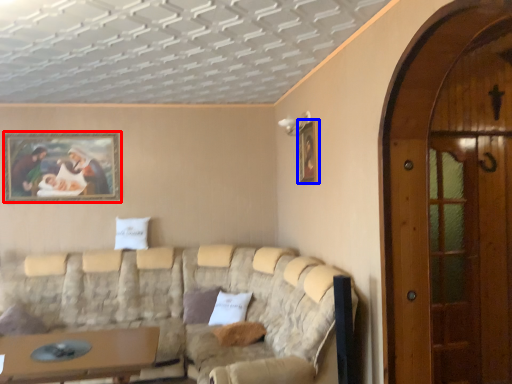
Question: Which object is closer to the camera taking this photo, picture frame (highlighted by a red box) or picture frame (highlighted by a blue box)?

Choices:
 (A) picture frame
 (B) picture frame

Answer: (B)